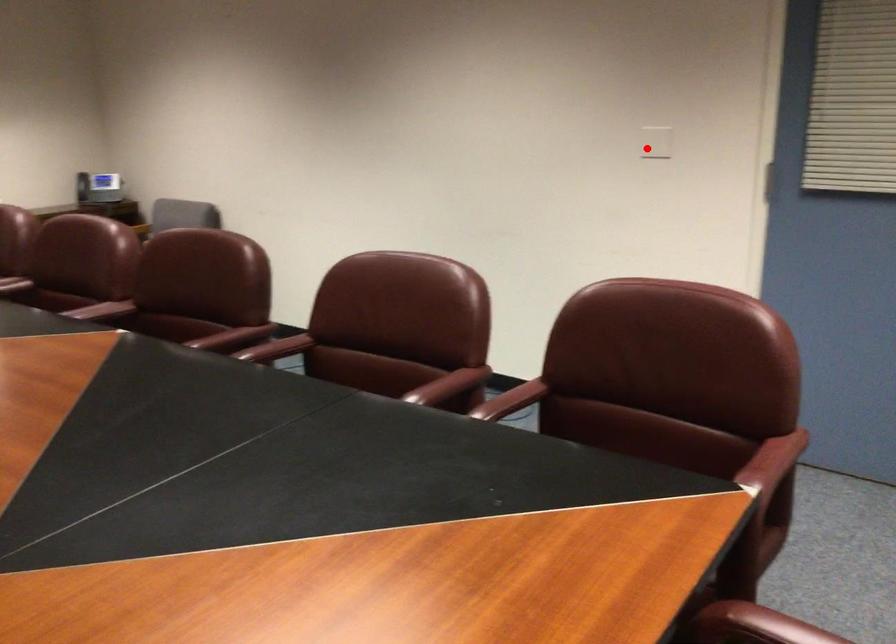
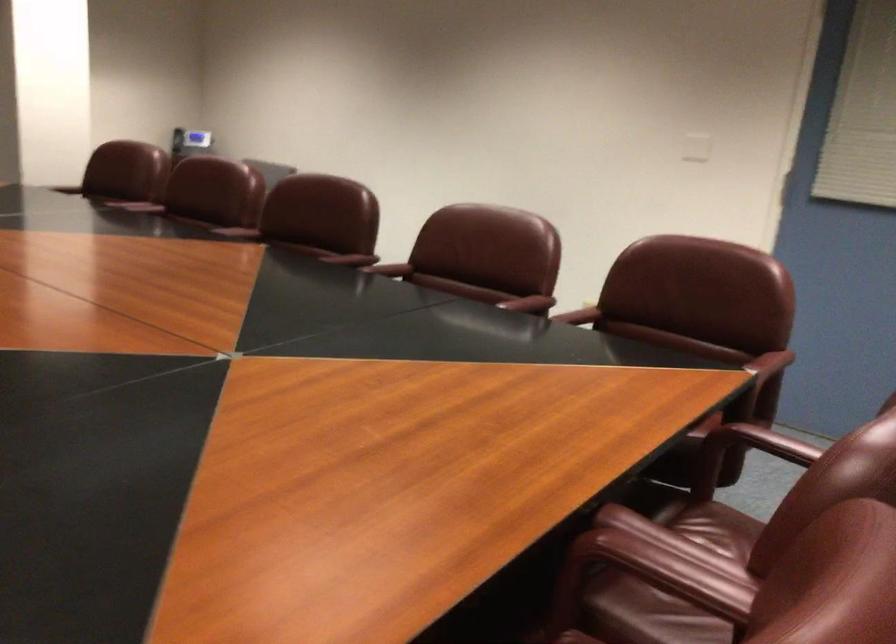
The point at the highlighted location is marked in the first image. Where is the corresponding point in the second image?

(695, 147)